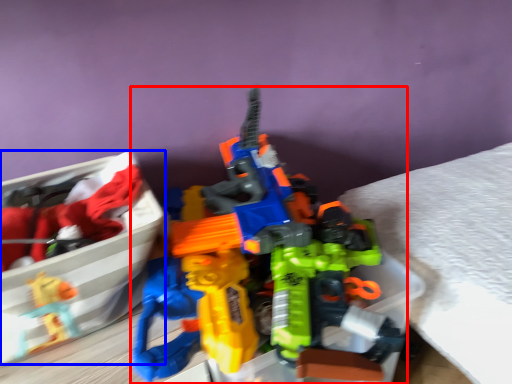
Question: Which of the following is the closest to the observer, toy (highlighted by a red box) or wide (highlighted by a blue box)?

Choices:
 (A) toy
 (B) wide

Answer: (A)